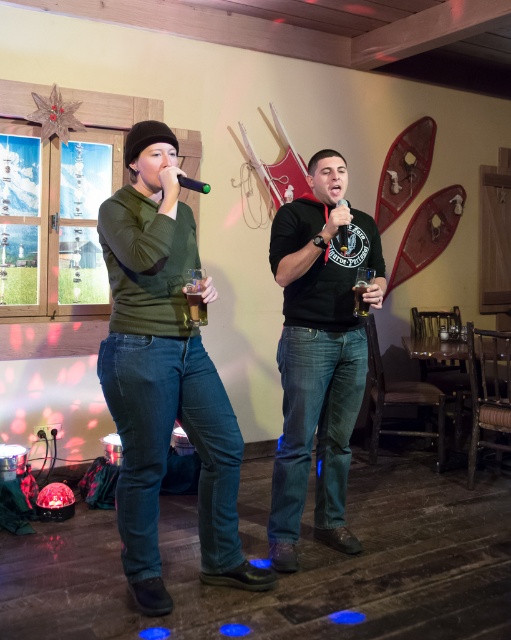
Is point (309, 442) less distant than point (194, 320)?

No.

Can you confirm if black matte t-shirt at center is bigger than translucent glass at center?

Yes, black matte t-shirt at center is bigger than translucent glass at center.

Is point (368, 246) in front of point (194, 298)?

No.

The image size is (511, 640). What are the coordinates of `black matte t-shirt at center` in the screenshot? It's located at (318, 353).

In the scene shown: Who is taller, black matte t-shirt at center or translucent glass beer at center?

black matte t-shirt at center

Is black matte t-shirt at center below translucent glass beer at center?

Indeed, black matte t-shirt at center is positioned under translucent glass beer at center.

What do you see at coordinates (318, 353) in the screenshot? I see `black matte t-shirt at center` at bounding box center [318, 353].

Where is `black matte t-shirt at center`? The height and width of the screenshot is (640, 511). black matte t-shirt at center is located at coordinates (318, 353).

Is point (192, 292) positioned before point (358, 305)?

Yes, point (192, 292) is in front of point (358, 305).

Which is more to the left, translucent glass at center or translucent glass beer at center?

From the viewer's perspective, translucent glass at center appears more on the left side.

This screenshot has height=640, width=511. What do you see at coordinates (196, 304) in the screenshot? I see `translucent glass at center` at bounding box center [196, 304].

Identify the location of translucent glass at center. The image size is (511, 640). (196, 304).